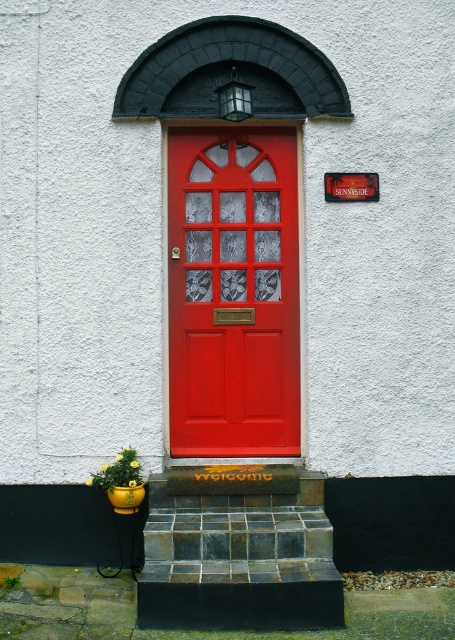
You are standing in front of the red front door and want to reach a point that is 17.41 feet away from you. Is the point at coordinates point (296, 340) within the area of the door?

The point (296, 340) is 17.41 feet away from the viewer, so yes, it is within the area of the door since the distance matches the specified requirement.

You are standing in front of the red front door and want to determine the relative positions of two points marked on the door. The first point is at coordinates point (241, 150) and the second is at point (337, 604). Which point is closer to you?

Point (241, 150) is further to the viewer than point (337, 604), so the point closer to you is point (337, 604).